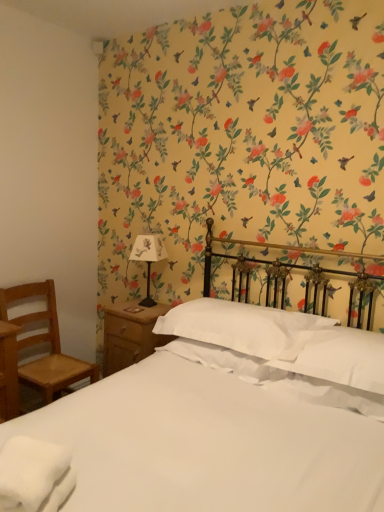
Identify the location of free location above wooden nightstand at lower left (from a real-world perspective). This screenshot has width=384, height=512. (135, 308).